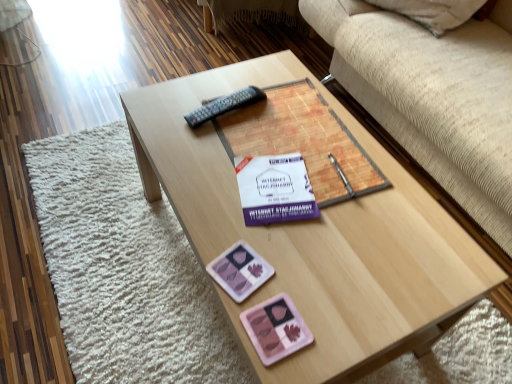
The width and height of the screenshot is (512, 384). I want to click on free point above wooden coffee table at center (from a real-world perspective), so click(x=290, y=177).